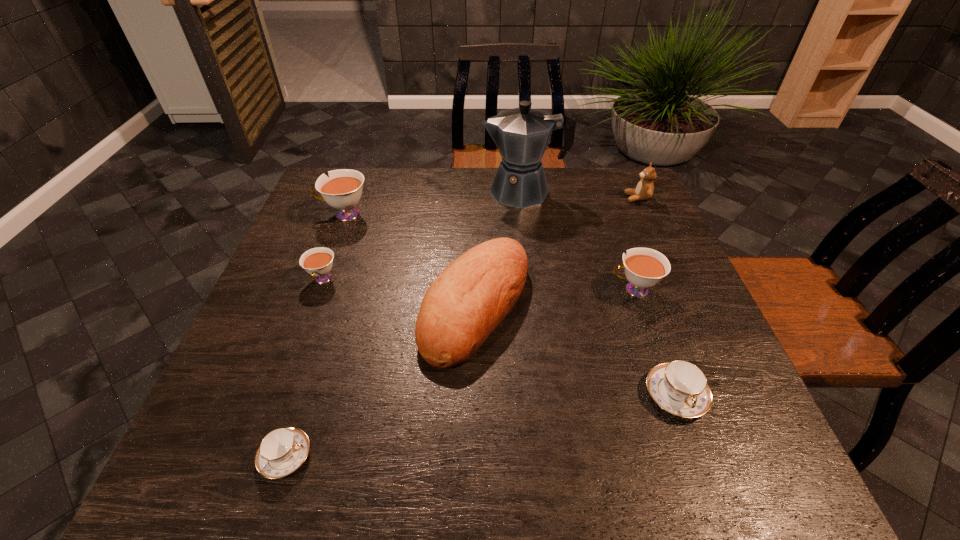
The width and height of the screenshot is (960, 540). What are the coordinates of `free spot located on the side of the rightmost white teacup with the handle` in the screenshot? It's located at (505, 290).

Image resolution: width=960 pixels, height=540 pixels. I want to click on vacant space located 0.290m on the side of the rightmost white teacup with the handle, so click(x=488, y=290).

Where is `free space located 0.060m on the side of the smallest white teacup with the handle`? free space located 0.060m on the side of the smallest white teacup with the handle is located at coordinates (311, 312).

Identify the location of vacant space situated 0.090m on the side with the handle of the bigger blue teacup. (704, 474).

The width and height of the screenshot is (960, 540). I want to click on vacant space located 0.210m on the side with the handle of the smaller blue teacup, so click(432, 456).

This screenshot has height=540, width=960. In order to click on coffeepot present at the far edge in this screenshot , I will do `click(521, 134)`.

At what (x,y) coordinates should I click in order to perform the action: click on teddy bear positioned at the far edge. Please return your answer as a coordinate pair (x, y). This screenshot has height=540, width=960. Looking at the image, I should click on (644, 190).

The image size is (960, 540). Find the location of `teacup that is at the far edge`. teacup that is at the far edge is located at coordinates (342, 190).

The height and width of the screenshot is (540, 960). In order to click on object present at the near edge in this screenshot , I will do `click(282, 451)`.

I want to click on teddy bear situated at the right edge, so click(644, 190).